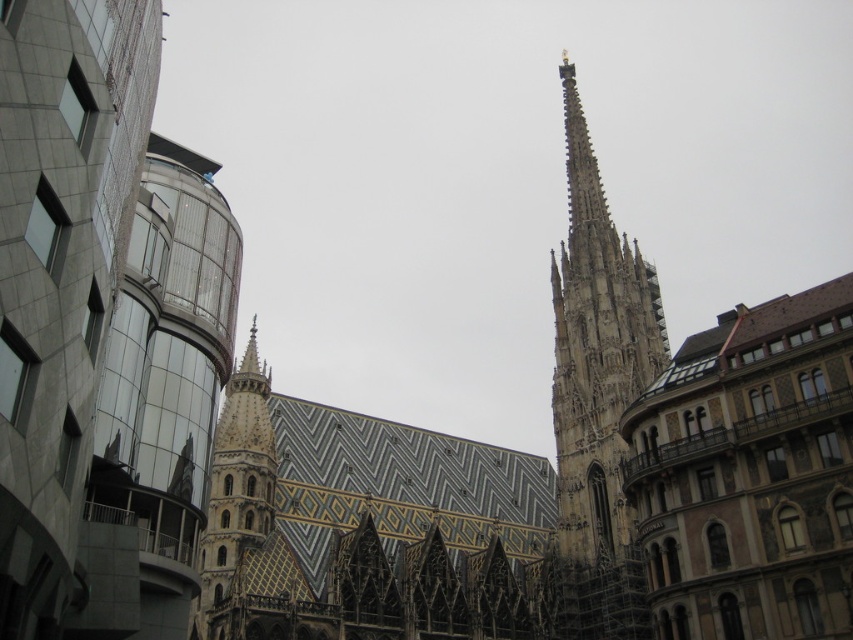
You are a photographer standing in front of the modern building on the left. You want to capture both the stone spire at upper right and the golden mosaic tower at center in your shot. Which structure will appear closer to you in the photo?

The stone spire at upper right will appear closer to you in the photo because it is positioned closer to the viewer compared to the golden mosaic tower at center.